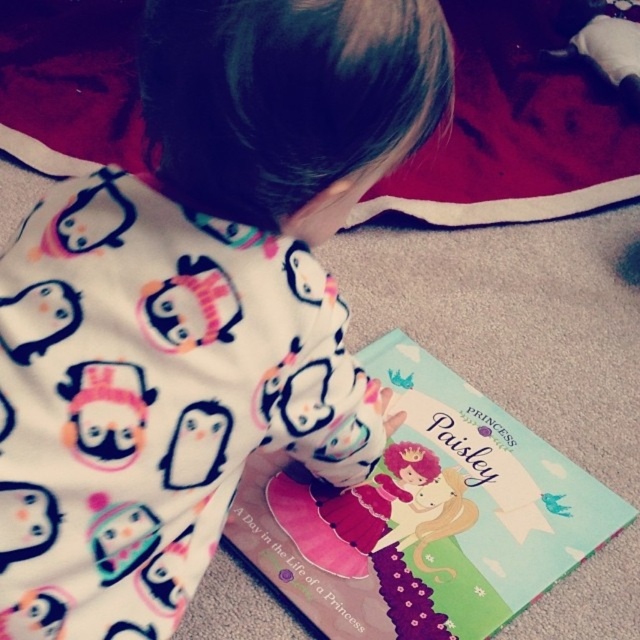
Which is above, white soft pajamas at center or matte paper book at center?

white soft pajamas at center

Does point (385, 54) come farther from viewer compared to point (476, 628)?

No, it is not.

Which is in front, point (106, 490) or point (349, 625)?

Positioned in front is point (106, 490).

The width and height of the screenshot is (640, 640). What are the coordinates of `white soft pajamas at center` in the screenshot? It's located at (196, 304).